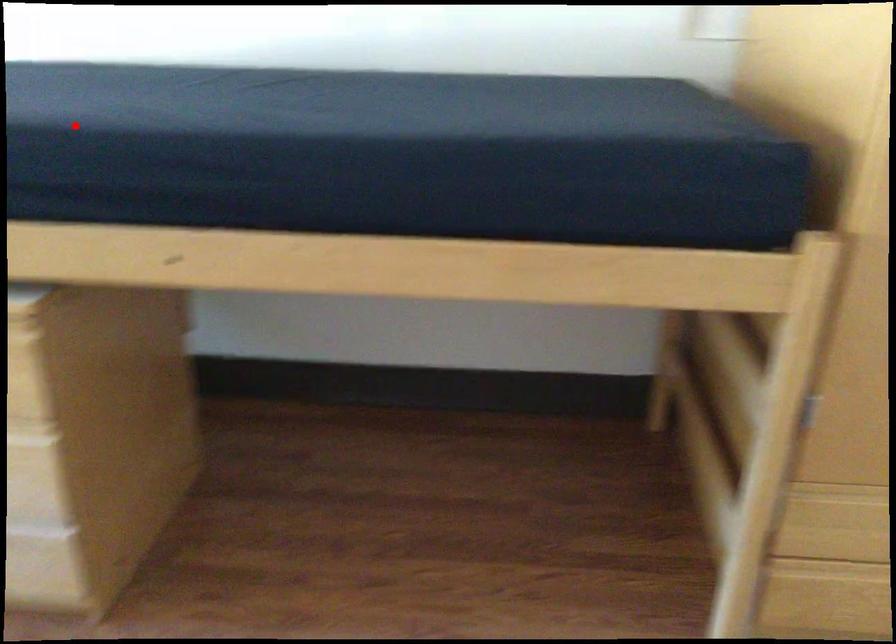
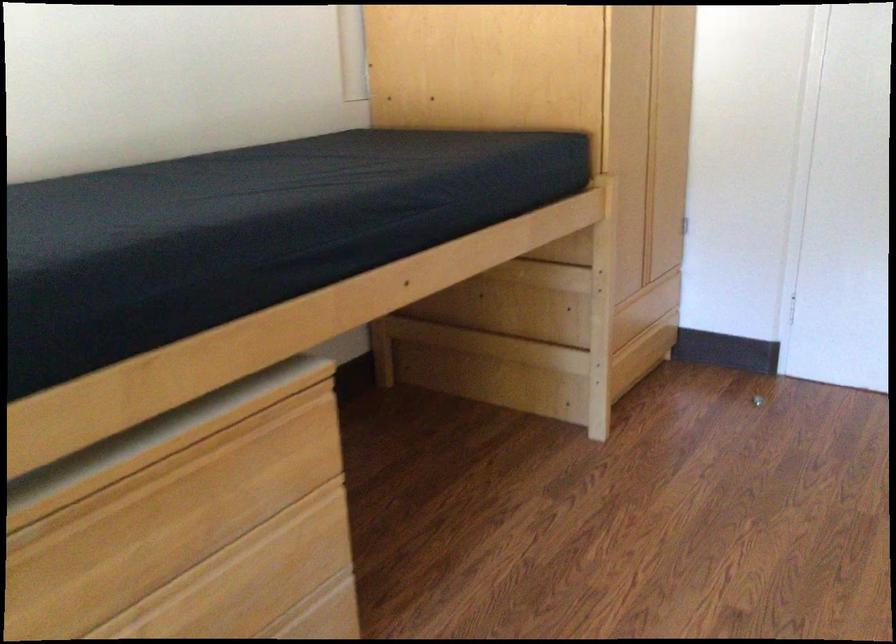
Find the pixel in the second image that matches the highlighted location in the first image.

(288, 205)